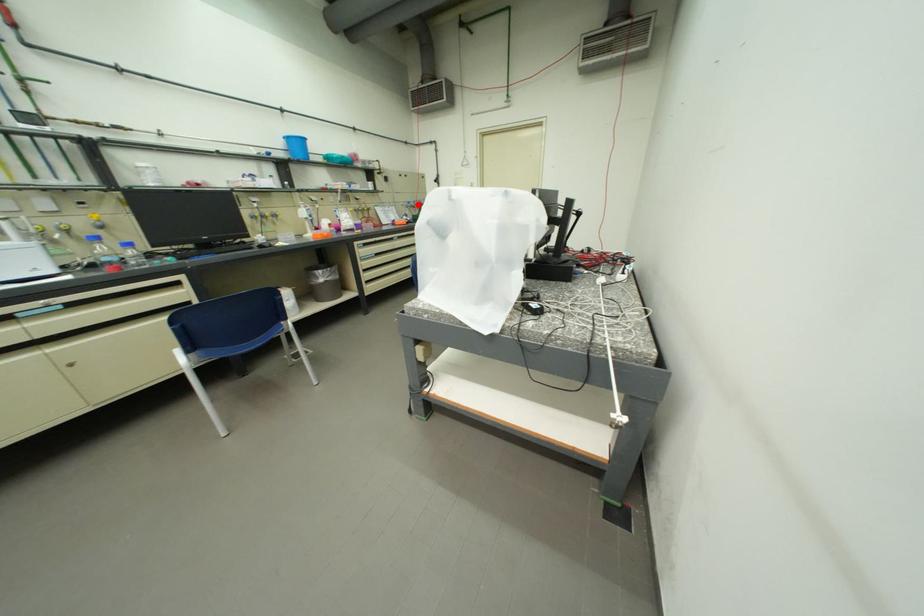
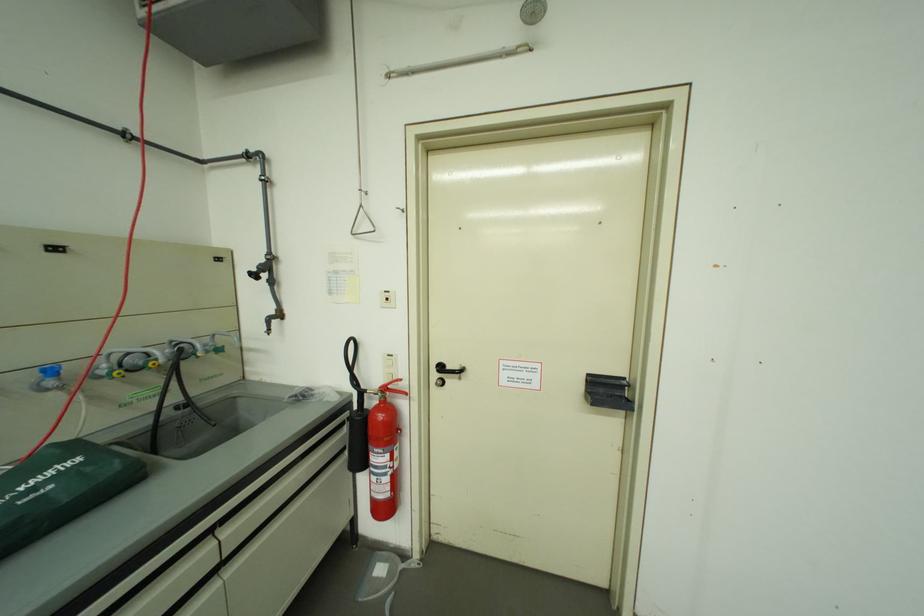
The point at the highlighted location is marked in the first image. Where is the corresponding point in the second image?

(62, 373)